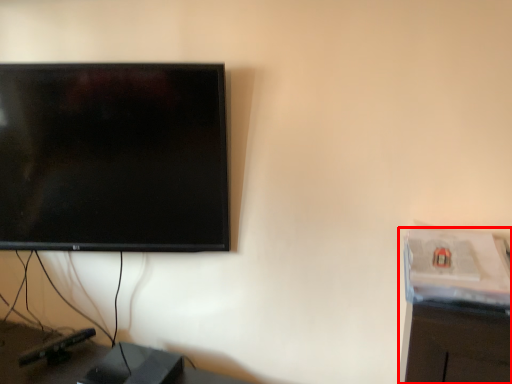
Question: Considering the relative positions of computer desk (annotated by the red box) and furniture in the image provided, where is computer desk (annotated by the red box) located with respect to the staircase?

Choices:
 (A) right
 (B) left

Answer: (A)